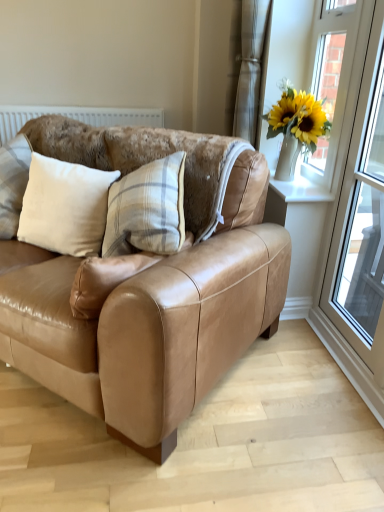
Question: Does tan leather couch at center lie in front of beige fabric pillow at left?

Choices:
 (A) no
 (B) yes

Answer: (B)

Question: Can you confirm if tan leather couch at center is thinner than beige fabric pillow at left?

Choices:
 (A) no
 (B) yes

Answer: (A)

Question: From the image's perspective, is tan leather couch at center under beige fabric pillow at left?

Choices:
 (A) no
 (B) yes

Answer: (B)

Question: Is tan leather couch at center facing towards beige fabric pillow at left?

Choices:
 (A) no
 (B) yes

Answer: (B)

Question: Is tan leather couch at center not near beige fabric pillow at left?

Choices:
 (A) no
 (B) yes

Answer: (A)

Question: Does tan leather couch at center have a lesser height compared to beige fabric pillow at left?

Choices:
 (A) yes
 (B) no

Answer: (B)

Question: Is beige fabric pillow at left far away from white plastic window frame at right?

Choices:
 (A) yes
 (B) no

Answer: (A)

Question: Is beige fabric pillow at left looking in the opposite direction of white plastic window frame at right?

Choices:
 (A) no
 (B) yes

Answer: (A)

Question: From a real-world perspective, is beige fabric pillow at left physically above white plastic window frame at right?

Choices:
 (A) no
 (B) yes

Answer: (A)

Question: Does beige fabric pillow at left have a larger size compared to white plastic window frame at right?

Choices:
 (A) no
 (B) yes

Answer: (A)

Question: Is the position of beige fabric pillow at left more distant than that of white plastic window frame at right?

Choices:
 (A) no
 (B) yes

Answer: (B)

Question: Considering the relative sizes of beige fabric pillow at left and white plastic window frame at right in the image provided, is beige fabric pillow at left taller than white plastic window frame at right?

Choices:
 (A) no
 (B) yes

Answer: (A)

Question: Is tan leather couch at center shorter than white smooth window sill at upper right?

Choices:
 (A) yes
 (B) no

Answer: (B)